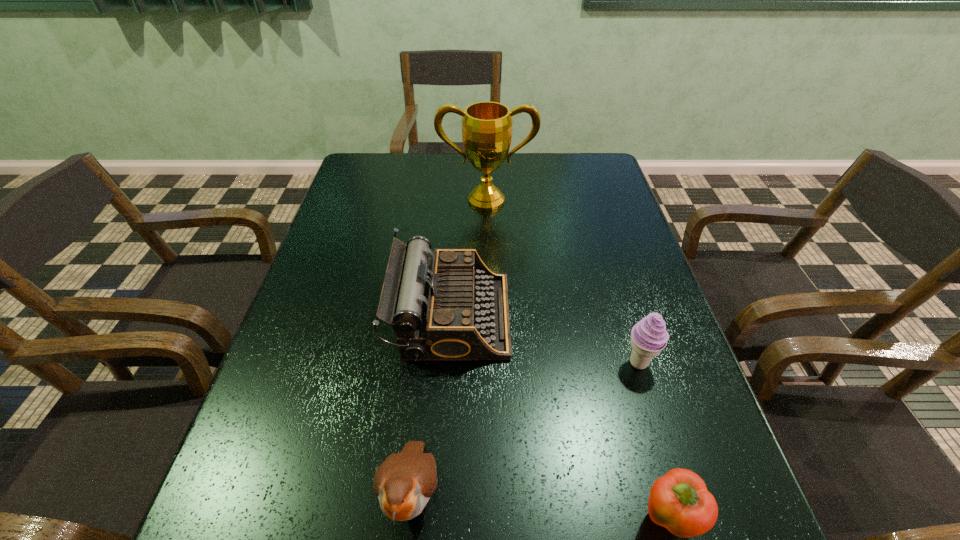
Find the location of a particular element. The image size is (960, 540). award is located at coordinates (486, 126).

You are a GUI agent. You are given a task and a screenshot of the screen. Output one action in this format:
    pyautogui.click(x=<x>, y=<y>)
    Task: Click on the farthest object
    
    Given the screenshot: What is the action you would take?
    pyautogui.click(x=486, y=126)

You are a GUI agent. You are given a task and a screenshot of the screen. Output one action in this format:
    pyautogui.click(x=<x>, y=<y>)
    Task: Click on the typewriter
    Image resolution: width=960 pixels, height=540 pixels.
    Given the screenshot: What is the action you would take?
    pyautogui.click(x=451, y=306)

This screenshot has height=540, width=960. What are the coordinates of `icecream` in the screenshot? It's located at (649, 337).

The image size is (960, 540). Find the location of `blank area located 0.280m on the front-facing side of the award`. blank area located 0.280m on the front-facing side of the award is located at coordinates (488, 279).

Image resolution: width=960 pixels, height=540 pixels. Find the location of `vacant region located 0.290m on the keyboard of the typewriter`. vacant region located 0.290m on the keyboard of the typewriter is located at coordinates (634, 316).

The height and width of the screenshot is (540, 960). Find the location of `vacant space located on the left of the icecream`. vacant space located on the left of the icecream is located at coordinates (480, 362).

At what (x,y) coordinates should I click in order to perform the action: click on object at the far edge. Please return your answer as a coordinate pair (x, y). This screenshot has width=960, height=540. Looking at the image, I should click on (486, 126).

The height and width of the screenshot is (540, 960). Identify the location of object located at the right edge. (649, 337).

This screenshot has height=540, width=960. I want to click on vacant space at the far edge of the desktop, so point(513,167).